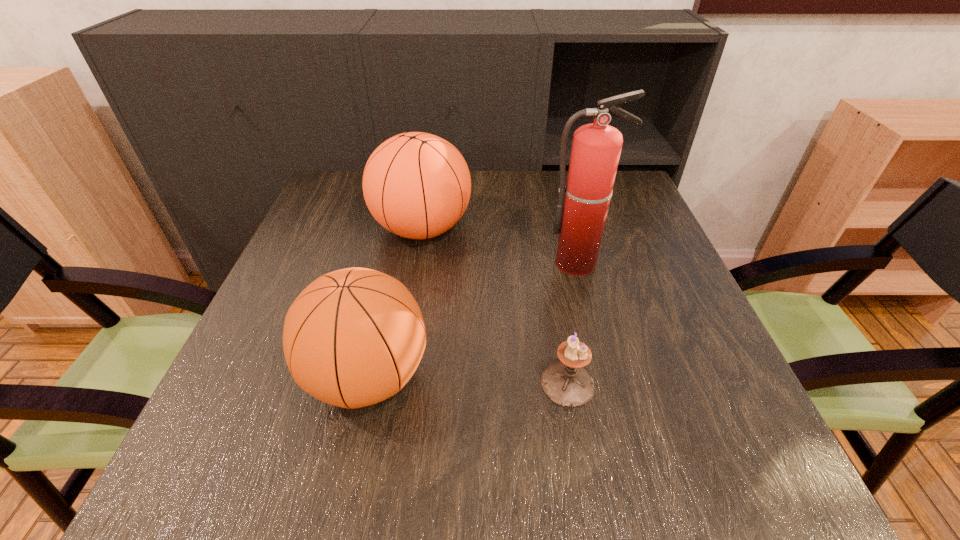
At what (x,y) coordinates should I click in order to perform the action: click on object at the right edge. Please return your answer as a coordinate pair (x, y). Looking at the image, I should click on (596, 148).

This screenshot has width=960, height=540. What are the coordinates of `vacant space at the far edge` in the screenshot? It's located at (479, 181).

In the image, there is a desktop. Where is `vacant space at the near edge`? vacant space at the near edge is located at coordinates (382, 488).

In the image, there is a desktop. Identify the location of vacant space at the left edge. The image size is (960, 540). (281, 286).

Locate an element on the screen. vacant space at the right edge of the desktop is located at coordinates (662, 258).

The height and width of the screenshot is (540, 960). In the image, there is a desktop. In order to click on blank space at the near left corner in this screenshot , I will do coord(270,451).

Identify the location of free space at the far right corner of the desktop. This screenshot has height=540, width=960. (626, 185).

Image resolution: width=960 pixels, height=540 pixels. I want to click on free location at the near right corner of the desktop, so click(x=694, y=461).

This screenshot has width=960, height=540. In order to click on empty space that is in between the tallest object and the nearer basketball in this screenshot , I will do `click(473, 320)`.

Identify the location of free space between the nearer basketball and the candle holder. This screenshot has height=540, width=960. (468, 381).